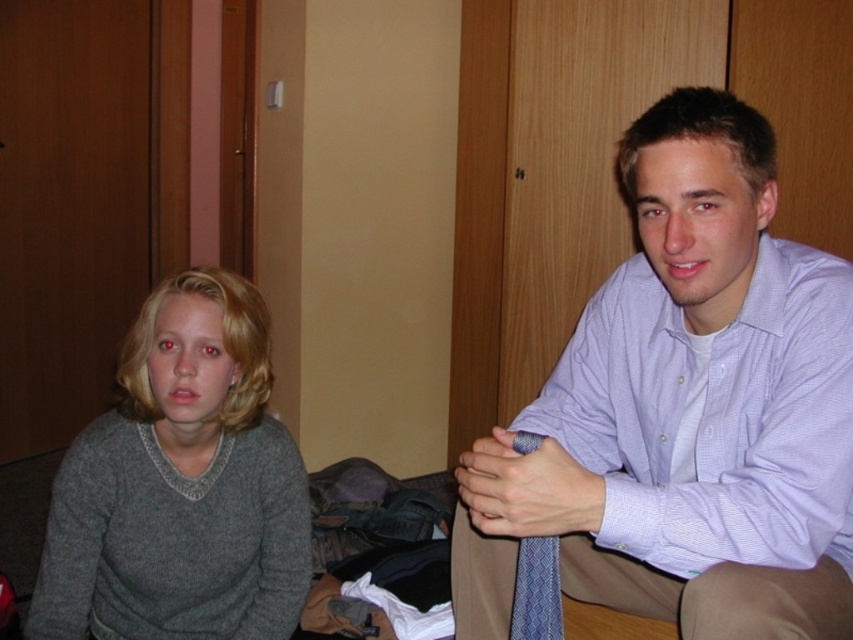
You are a tailor measuring the distance between the light purple shirt at upper right and the blue textured tie at center for a custom fit. The minimum required space for proper tailoring is 10 inches. Can the current spacing accommodate the requirements?

The distance between the light purple shirt at upper right and the blue textured tie at center is 9.45 inches, which is less than the required 10 inches. Therefore, the current spacing cannot accommodate the tailoring requirements.